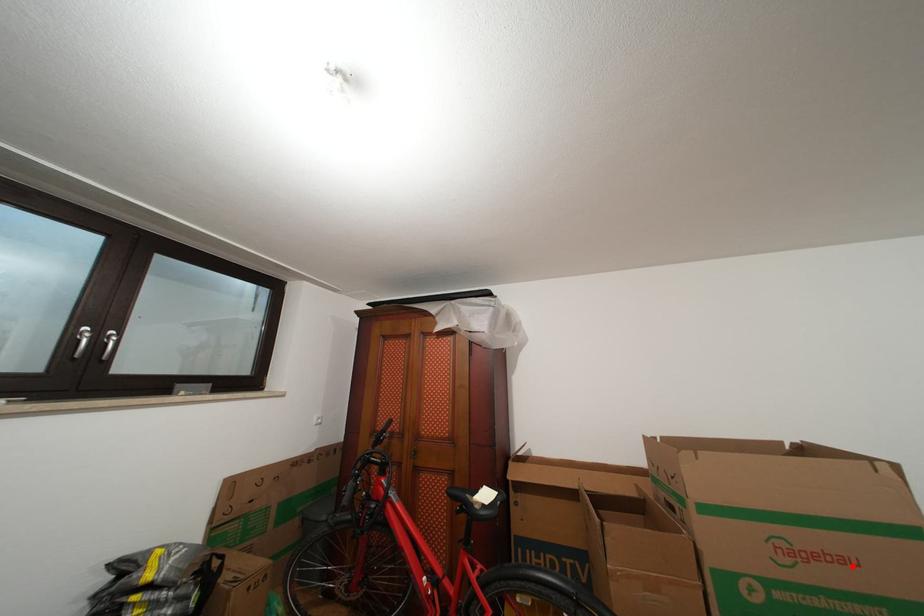
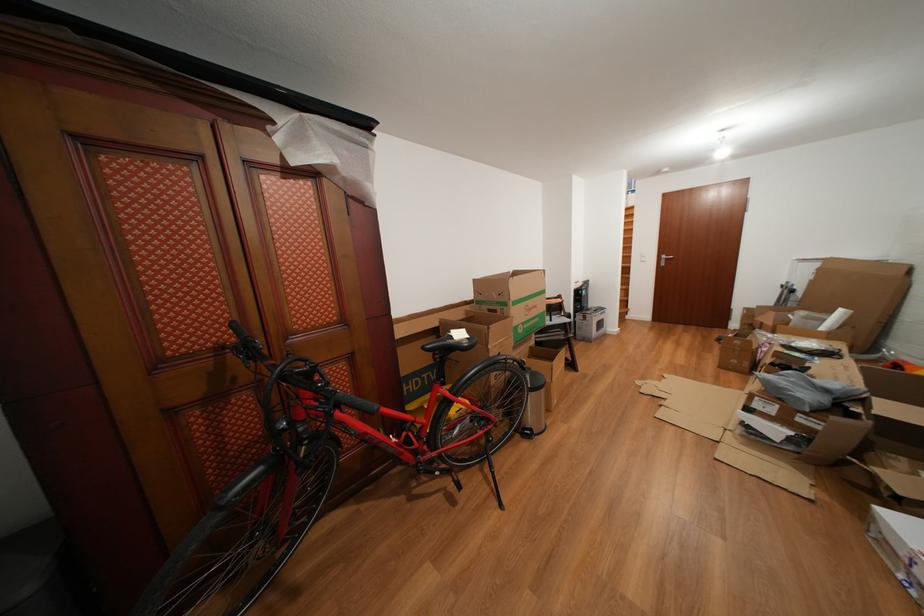
Locate, in the second image, the point that corresponds to the highlighted location in the first image.

(543, 312)